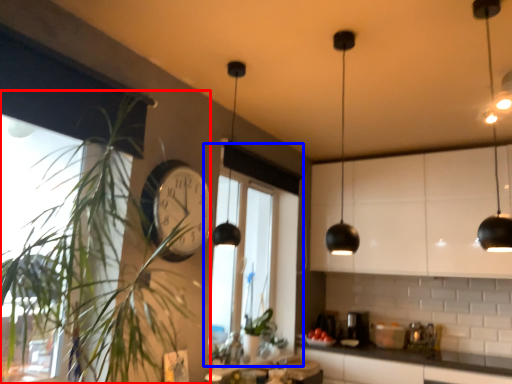
Question: Among these objects, which one is nearest to the camera, houseplant (highlighted by a red box) or window (highlighted by a blue box)?

Choices:
 (A) houseplant
 (B) window

Answer: (A)